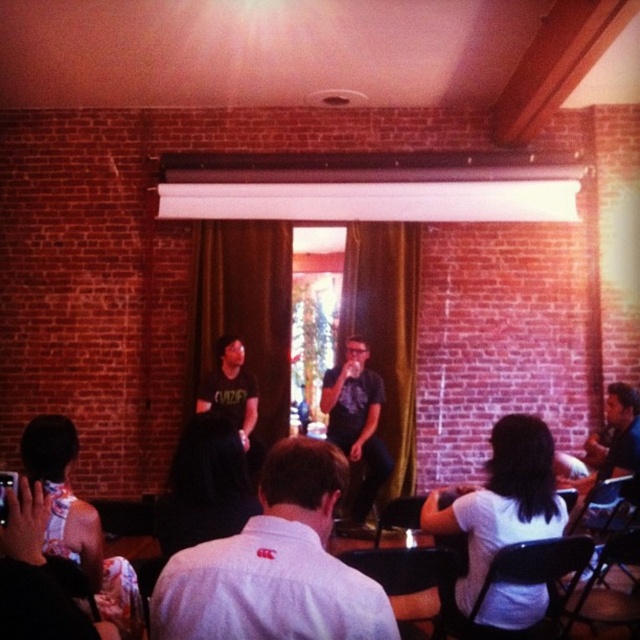
Question: Which point appears farthest from the camera in this image?

Choices:
 (A) (221, 390)
 (B) (323, 451)
 (C) (356, 392)

Answer: (C)

Question: Among these points, which one is farthest from the camera?

Choices:
 (A) click(x=352, y=376)
 (B) click(x=316, y=476)
 (C) click(x=204, y=394)

Answer: (A)

Question: Is white cotton shirt at center closer to camera compared to black matte shirt at center?

Choices:
 (A) no
 (B) yes

Answer: (B)

Question: Is white cotton shirt at center thinner than matte black shirt at center?

Choices:
 (A) no
 (B) yes

Answer: (A)

Question: Can you confirm if white cotton shirt at center is thinner than matte black shirt at center?

Choices:
 (A) yes
 (B) no

Answer: (B)

Question: Which point appears farthest from the camera in this image?

Choices:
 (A) (253, 406)
 (B) (362, 480)
 (C) (176, 580)

Answer: (B)